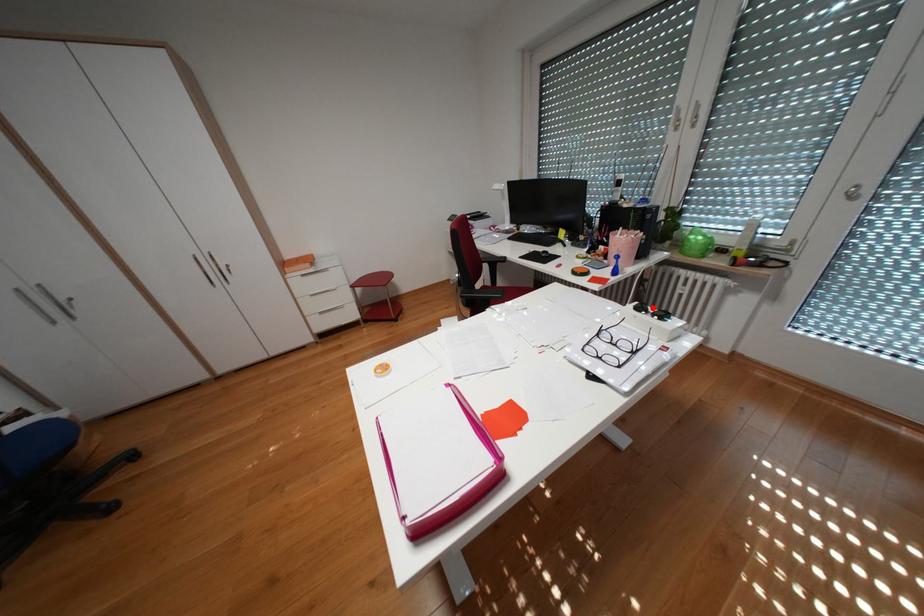
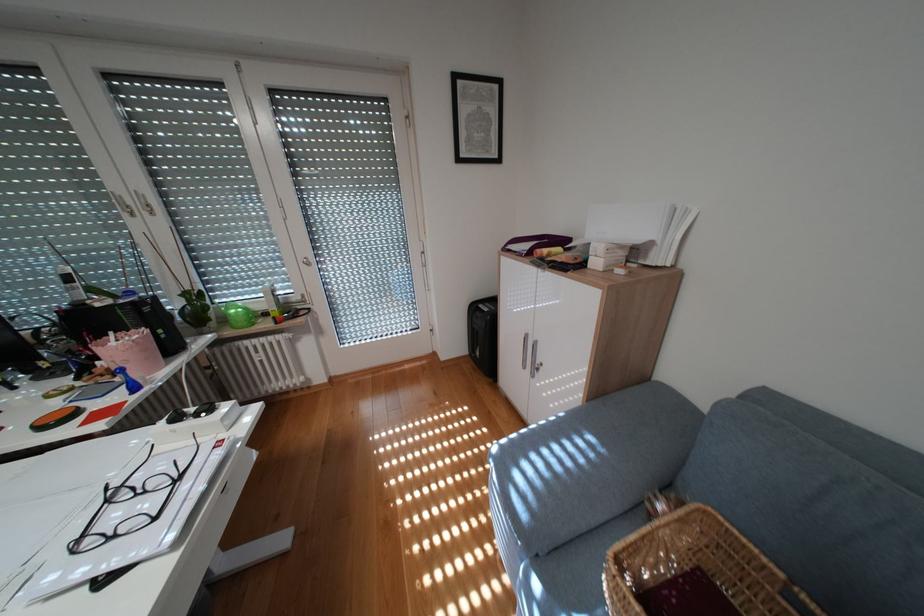
Question: I am providing you with two images of the same scene from different viewpoints. A red point is marked on the first image. Can you still see the location of the red point in image 2?

Choices:
 (A) Yes
 (B) No

Answer: (A)